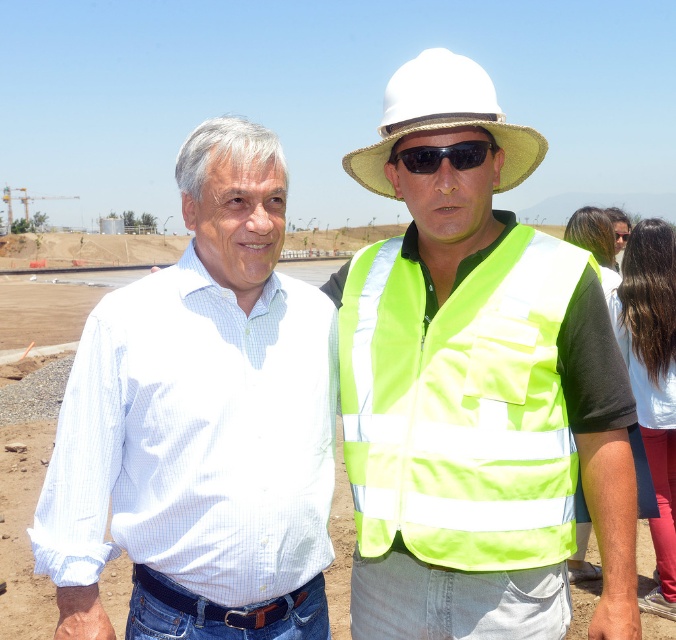
You are a construction worker who needs to locate the white checkered shirt at center and the reflective yellow vest at center. From your current position, which one is closer to you?

The reflective yellow vest at center is closer to you because the white checkered shirt at center is behind it.